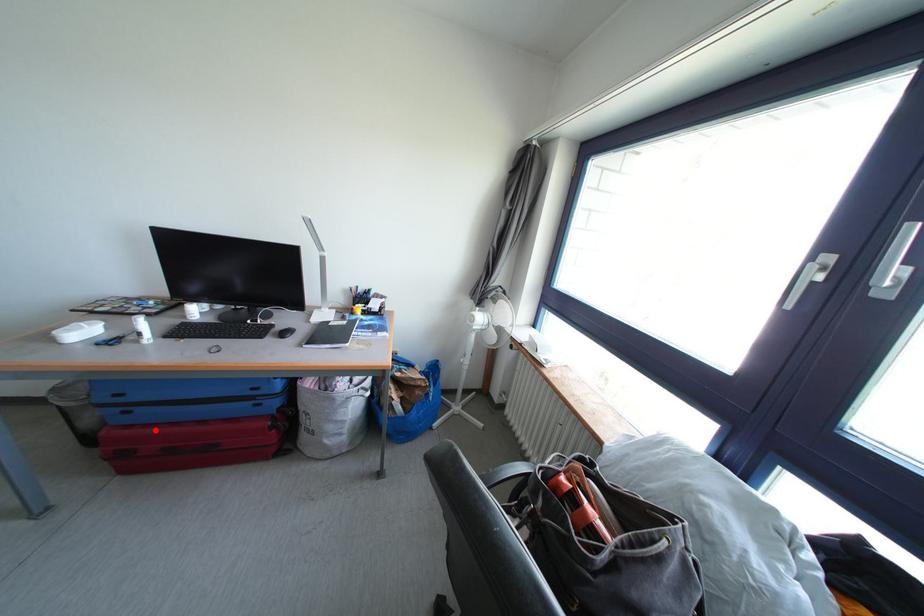
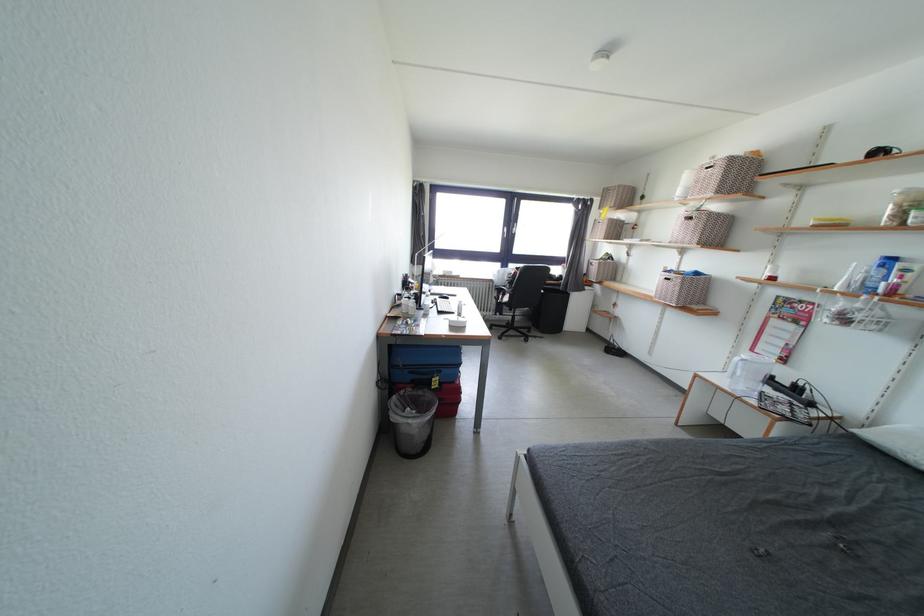
Question: I am providing you with two images of the same scene from different viewpoints. A red point is marked on the first image. At the location where the point appears in image 1, is it still visible in image 2?

Choices:
 (A) Yes
 (B) No

Answer: (B)